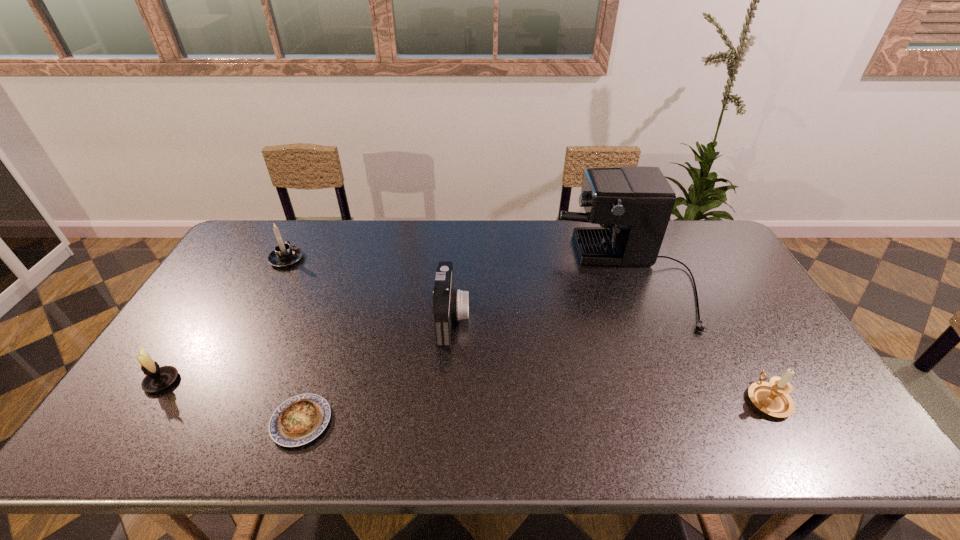
The height and width of the screenshot is (540, 960). I want to click on vacant space at the far left corner of the desktop, so click(x=264, y=257).

The height and width of the screenshot is (540, 960). In the image, there is a desktop. Identify the location of free space at the near left corner. (184, 420).

The image size is (960, 540). In order to click on vacant region at the far right corner of the desktop in this screenshot , I will do [x=705, y=255].

Locate an element on the screen. The image size is (960, 540). vacant space that's between the second candle holder from left to right and the quiche is located at coordinates (294, 340).

Locate an element on the screen. This screenshot has width=960, height=540. unoccupied position between the tallest object and the quiche is located at coordinates (465, 349).

The height and width of the screenshot is (540, 960). I want to click on free space between the leftmost object and the camcorder, so tap(307, 349).

Image resolution: width=960 pixels, height=540 pixels. I want to click on free space between the camcorder and the coffee maker, so click(540, 298).

Where is `free spot between the rightmost candle holder and the leftmost candle holder`? This screenshot has height=540, width=960. free spot between the rightmost candle holder and the leftmost candle holder is located at coordinates (465, 390).

At what (x,y) coordinates should I click in order to perform the action: click on free space between the coffee maker and the third object from left to right. Please return your answer as a coordinate pair (x, y). This screenshot has width=960, height=540. Looking at the image, I should click on (x=465, y=349).

You are a GUI agent. You are given a task and a screenshot of the screen. Output one action in this format:
    pyautogui.click(x=<x>, y=<y>)
    Task: Click on the vacant region between the second candle holder from left to right and the leftmost candle holder
    The height and width of the screenshot is (540, 960).
    Given the screenshot: What is the action you would take?
    pyautogui.click(x=224, y=320)